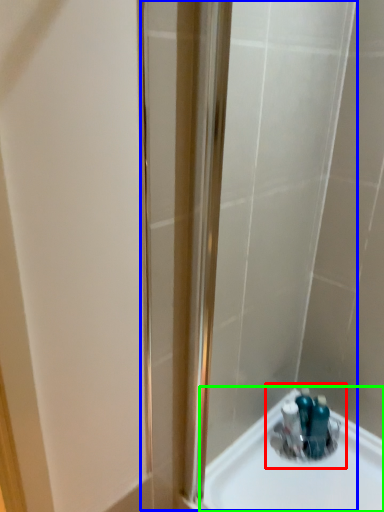
Question: Estimate the real-world distances between objects in this image. Which object is farther from sink (highlighted by a red box), shower door (highlighted by a blue box) or sink (highlighted by a green box)?

Choices:
 (A) shower door
 (B) sink

Answer: (A)